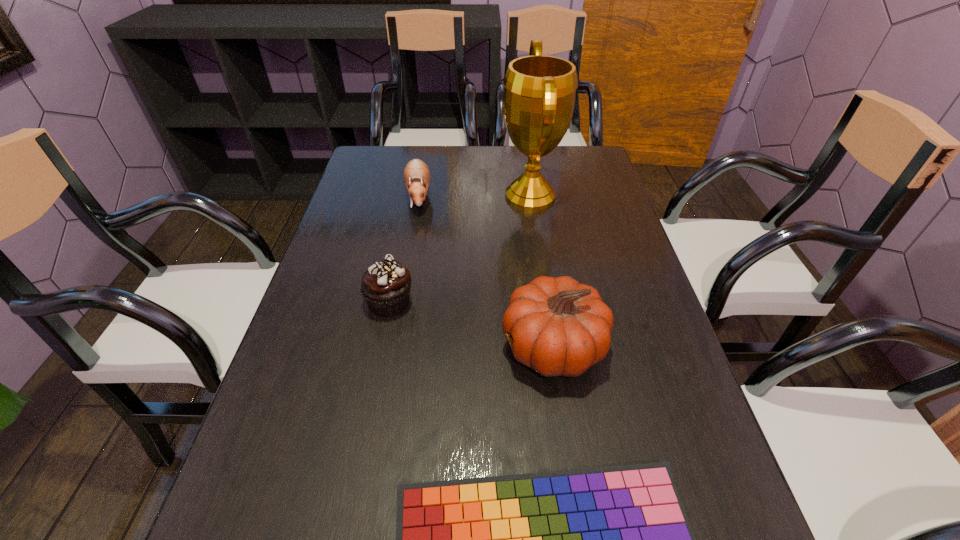
Find the location of `the tallest object`. the tallest object is located at coordinates (539, 91).

This screenshot has height=540, width=960. I want to click on pumpkin, so click(560, 327).

The height and width of the screenshot is (540, 960). Identify the location of cupcake. (385, 286).

What are the coordinates of `hamster` in the screenshot? It's located at (416, 173).

Find the location of a particular element. The image size is (960, 540). blank space located 0.260m on the front-facing side of the award is located at coordinates (414, 196).

Find the location of a particular element. This screenshot has width=960, height=540. free space located 0.300m on the front-facing side of the award is located at coordinates (400, 196).

The height and width of the screenshot is (540, 960). I want to click on free region located 0.220m on the front-facing side of the award, so click(x=427, y=196).

Where is `free location located on the face of the pumpkin`? free location located on the face of the pumpkin is located at coordinates (345, 347).

Locate an element on the screen. Image resolution: width=960 pixels, height=540 pixels. vacant space located on the face of the pumpkin is located at coordinates (354, 347).

I want to click on vacant point located on the face of the pumpkin, so click(x=440, y=347).